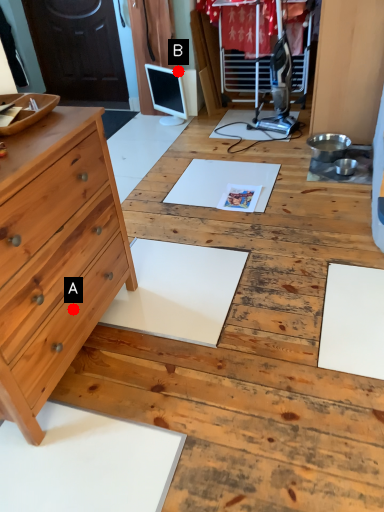
Question: Two points are circled on the image, labeled by A and B beside each circle. Which point is closer to the camera?

Choices:
 (A) A is closer
 (B) B is closer

Answer: (A)